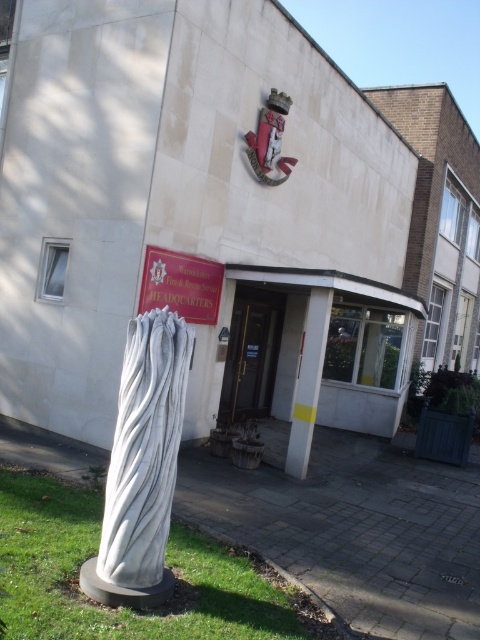
You are a visitor arriving at the Warwickshire Fire and Rescue Service Headquarters. You see the green grass at lower left and the white marble pillar at center. Which object is closer to you as you approach the building?

The green grass at lower left is closer to you because it is in front of the white marble pillar at center, indicating it is nearer in the line of sight.

You are standing at the point marked as point (186, 529) in the image. The red sign with gold letter is 15.84 feet away from you. Can you reach it without moving more than 15 feet?

The red sign with gold letter is 15.84 feet away from point (186, 529), so you cannot reach it without moving more than 15 feet.